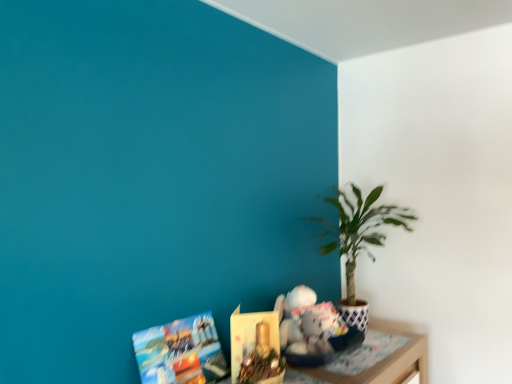
Find the location of a particular element. The height and width of the screenshot is (384, 512). free space above wooden table at lower right (from a real-world perspective) is located at coordinates pos(360,352).